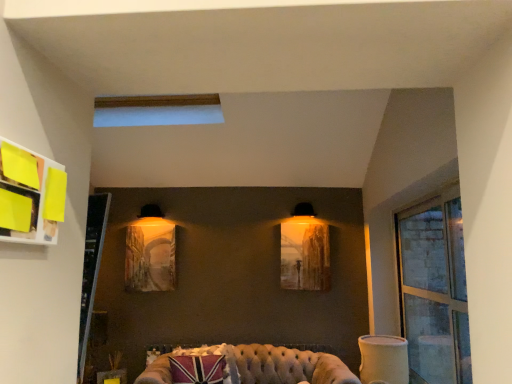
Question: In which direction should I rotate to look at matte wooden picture frame at center, the 2th picture frame viewed from the right?

Choices:
 (A) right
 (B) left

Answer: (B)

Question: From a real-world perspective, is tufted leather couch at lower center positioned over matte wooden picture frame at center, which is the first picture frame in left-to-right order, based on gravity?

Choices:
 (A) yes
 (B) no

Answer: (B)

Question: Is tufted leather couch at lower center positioned before matte wooden picture frame at center, which is the first picture frame in left-to-right order?

Choices:
 (A) yes
 (B) no

Answer: (A)

Question: Is tufted leather couch at lower center positioned beyond the bounds of matte wooden picture frame at center, the 2th picture frame viewed from the right?

Choices:
 (A) yes
 (B) no

Answer: (A)

Question: Considering the relative sizes of tufted leather couch at lower center and matte wooden picture frame at center, which is the first picture frame in left-to-right order, in the image provided, is tufted leather couch at lower center thinner than matte wooden picture frame at center, which is the first picture frame in left-to-right order,?

Choices:
 (A) no
 (B) yes

Answer: (A)

Question: Is tufted leather couch at lower center bigger than matte wooden picture frame at center, which is the first picture frame in left-to-right order?

Choices:
 (A) no
 (B) yes

Answer: (B)

Question: Does tufted leather couch at lower center have a greater width compared to matte wooden picture frame at center, which is the first picture frame in left-to-right order?

Choices:
 (A) yes
 (B) no

Answer: (A)

Question: Is transparent glass window at right turned away from matte wooden picture frame at center, which is the first picture frame in left-to-right order?

Choices:
 (A) no
 (B) yes

Answer: (A)

Question: From a real-world perspective, is transparent glass window at right physically above matte wooden picture frame at center, which is the first picture frame in left-to-right order?

Choices:
 (A) no
 (B) yes

Answer: (A)

Question: Could you tell me if transparent glass window at right is facing matte wooden picture frame at center, the 2th picture frame viewed from the right?

Choices:
 (A) no
 (B) yes

Answer: (B)

Question: Does transparent glass window at right have a greater width compared to matte wooden picture frame at center, which is the first picture frame in left-to-right order?

Choices:
 (A) no
 (B) yes

Answer: (B)

Question: From a real-world perspective, is transparent glass window at right beneath matte wooden picture frame at center, which is the first picture frame in left-to-right order?

Choices:
 (A) no
 (B) yes

Answer: (B)

Question: Is transparent glass window at right thinner than matte wooden picture frame at center, which is the first picture frame in left-to-right order?

Choices:
 (A) no
 (B) yes

Answer: (A)

Question: Can you confirm if matte glass picture frame at center, which appears as the 2th picture frame when viewed from the left, is positioned to the right of tufted leather couch at lower center?

Choices:
 (A) no
 (B) yes

Answer: (B)